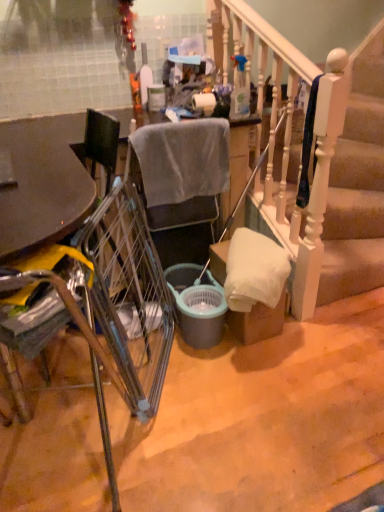
Question: Is gray fabric chair at center, which is the first chair from back to front, touching metallic silver chair at left, arranged as the second chair when viewed from the back?

Choices:
 (A) no
 (B) yes

Answer: (A)

Question: From the image's perspective, is gray fabric chair at center, which is the first chair from back to front, under metallic silver chair at left, arranged as the second chair when viewed from the back?

Choices:
 (A) yes
 (B) no

Answer: (B)

Question: From a real-world perspective, is gray fabric chair at center, which is the first chair from back to front, positioned under metallic silver chair at left, arranged as the second chair when viewed from the back, based on gravity?

Choices:
 (A) yes
 (B) no

Answer: (A)

Question: Does gray fabric chair at center, the 2th chair when ordered from front to back, appear on the right side of metallic silver chair at left, marked as the first chair in a front-to-back arrangement?

Choices:
 (A) yes
 (B) no

Answer: (A)

Question: From the image's perspective, is gray fabric chair at center, the 2th chair when ordered from front to back, located above metallic silver chair at left, arranged as the second chair when viewed from the back?

Choices:
 (A) no
 (B) yes

Answer: (B)

Question: Is gray fabric chair at center, which is the first chair from back to front, bigger than metallic silver chair at left, marked as the first chair in a front-to-back arrangement?

Choices:
 (A) no
 (B) yes

Answer: (A)

Question: From the image's perspective, is matte plastic trash can at center on white matte toilet paper at center?

Choices:
 (A) no
 (B) yes

Answer: (B)

Question: Does matte plastic trash can at center have a smaller size compared to white matte toilet paper at center?

Choices:
 (A) yes
 (B) no

Answer: (B)

Question: From a real-world perspective, is matte plastic trash can at center beneath white matte toilet paper at center?

Choices:
 (A) yes
 (B) no

Answer: (B)

Question: Is matte plastic trash can at center bigger than white matte toilet paper at center?

Choices:
 (A) yes
 (B) no

Answer: (A)

Question: Could white matte toilet paper at center be considered to be inside matte plastic trash can at center?

Choices:
 (A) yes
 (B) no

Answer: (B)

Question: Is matte plastic trash can at center positioned behind white matte toilet paper at center?

Choices:
 (A) yes
 (B) no

Answer: (A)

Question: Can you confirm if metallic silver chair at left, arranged as the second chair when viewed from the back, is bigger than metallic silver trolley at center?

Choices:
 (A) yes
 (B) no

Answer: (A)